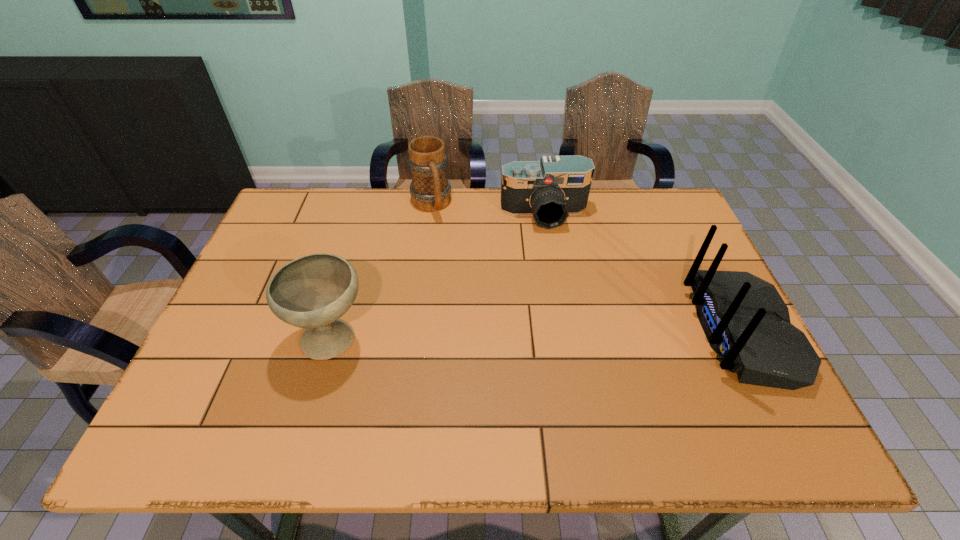
Identify the location of vacant space on the desktop that is between the leftmost object and the rightmost object and is positioned on the front-facing side of the camera. The width and height of the screenshot is (960, 540). click(x=569, y=334).

Identify the location of vacant space on the desktop that is between the leftmost object and the router and is positioned on the side of the third object from right to left with the handle. The image size is (960, 540). (488, 336).